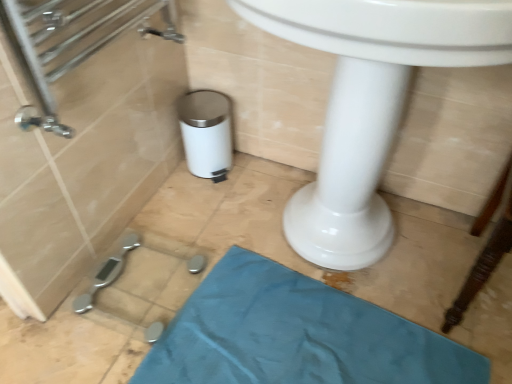
You are a GUI agent. You are given a task and a screenshot of the screen. Output one action in this format:
    pyautogui.click(x=<x>, y=<y>)
    Task: Click on the blank space situated above teal fabric bath mat at lower center (from a real-world perspective)
    The width and height of the screenshot is (512, 384).
    Given the screenshot: What is the action you would take?
    pyautogui.click(x=295, y=339)